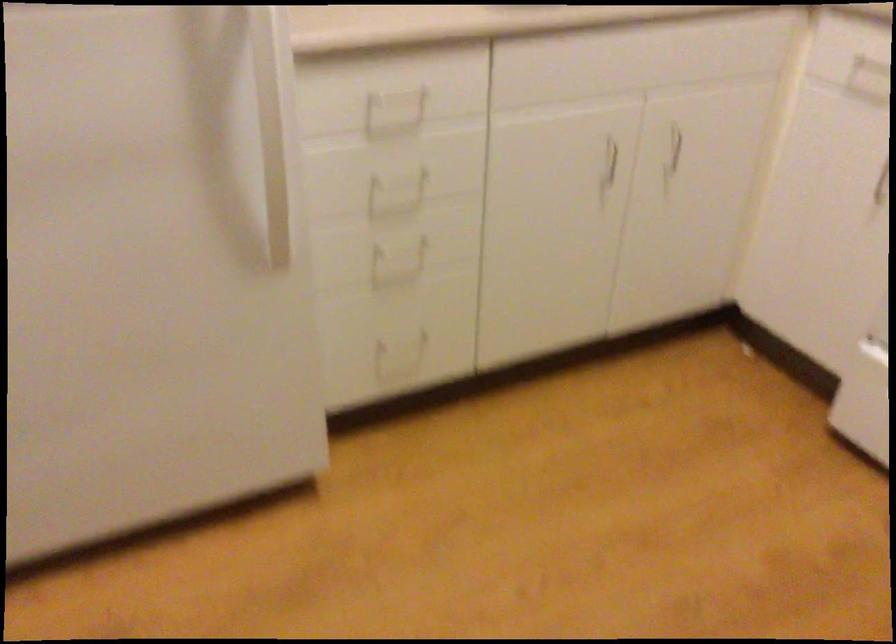
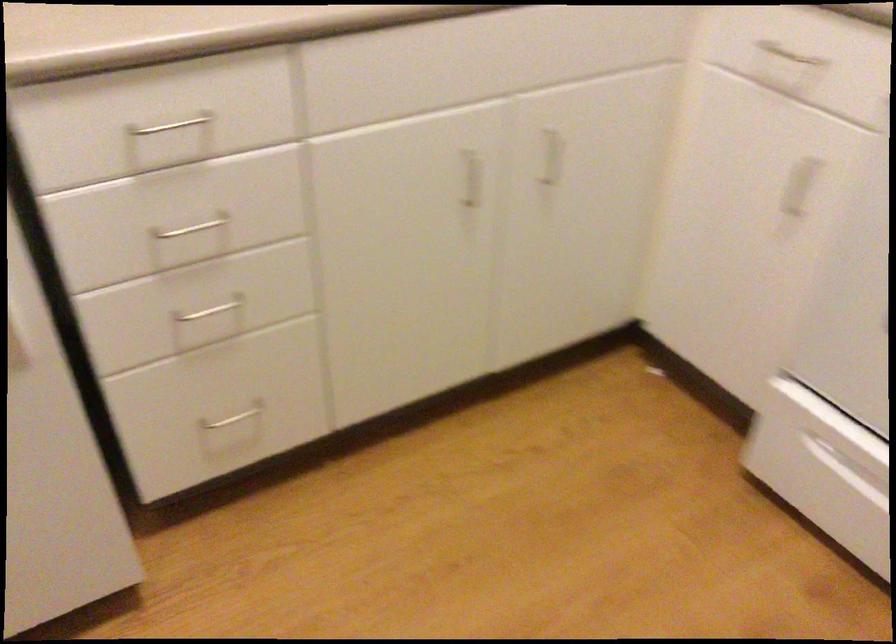
Locate, in the second image, the point that corresponds to point (392, 178) in the first image.

(192, 228)